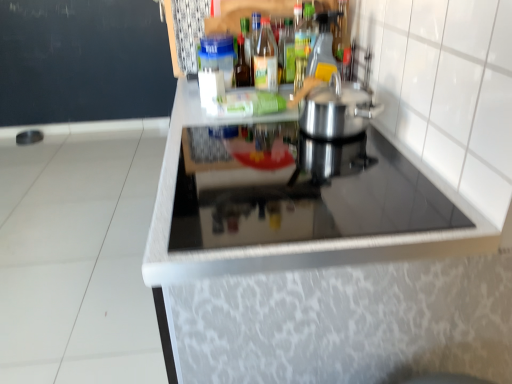
Where is `unoccupied area in front of satin silver pot at center`? Image resolution: width=512 pixels, height=384 pixels. unoccupied area in front of satin silver pot at center is located at coordinates (345, 177).